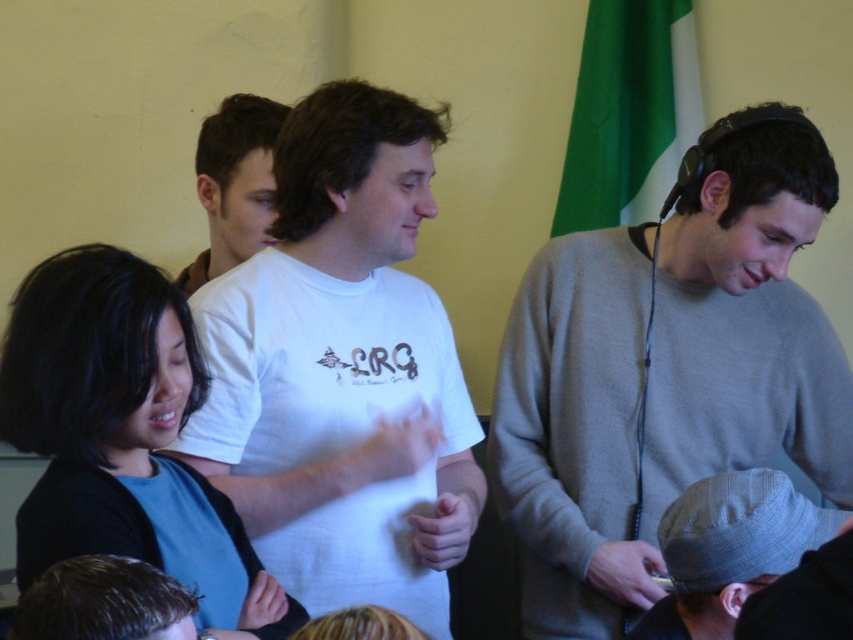
Is black matte hair at center thinner than white t-shirt at center?

No.

Who is positioned more to the right, black matte hair at center or white t-shirt at center?

black matte hair at center is more to the right.

What are the coordinates of `black matte hair at center` in the screenshot? It's located at (123, 436).

In the scene shown: Does gray sweater at center appear over white cotton t-shirt at center?

No.

Can you confirm if gray sweater at center is bigger than white cotton t-shirt at center?

Indeed, gray sweater at center has a larger size compared to white cotton t-shirt at center.

Where is `gray sweater at center`? gray sweater at center is located at coordinates (666, 371).

Does point (96, 308) come farther from viewer compared to point (753, 566)?

No, (96, 308) is in front of (753, 566).

Who is more distant from viewer, (229, 568) or (700, 596)?

Point (700, 596)

You are a GUI agent. You are given a task and a screenshot of the screen. Output one action in this format:
    pyautogui.click(x=<x>, y=<y>)
    Task: Click on the black matte hair at center
    Image resolution: width=853 pixels, height=640 pixels.
    Given the screenshot: What is the action you would take?
    pyautogui.click(x=123, y=436)